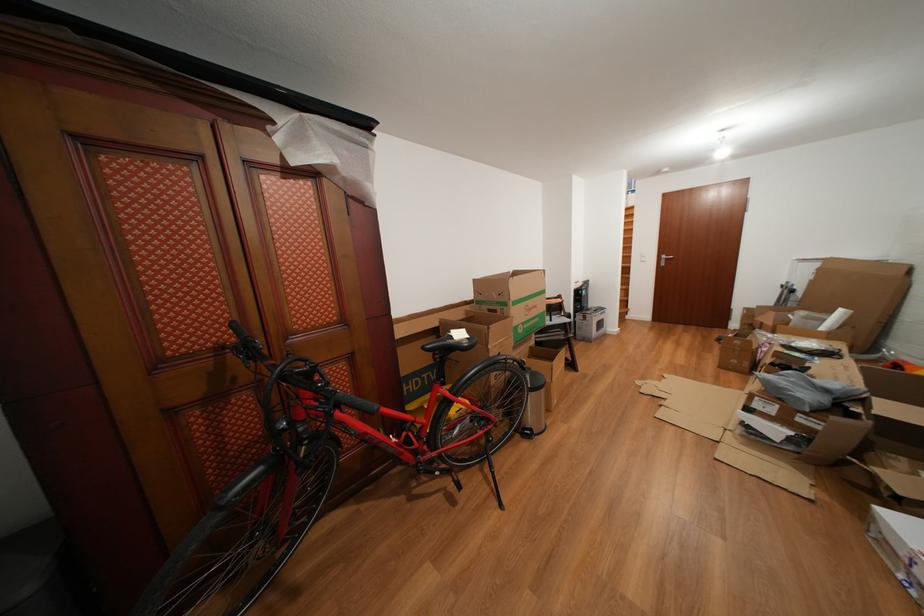
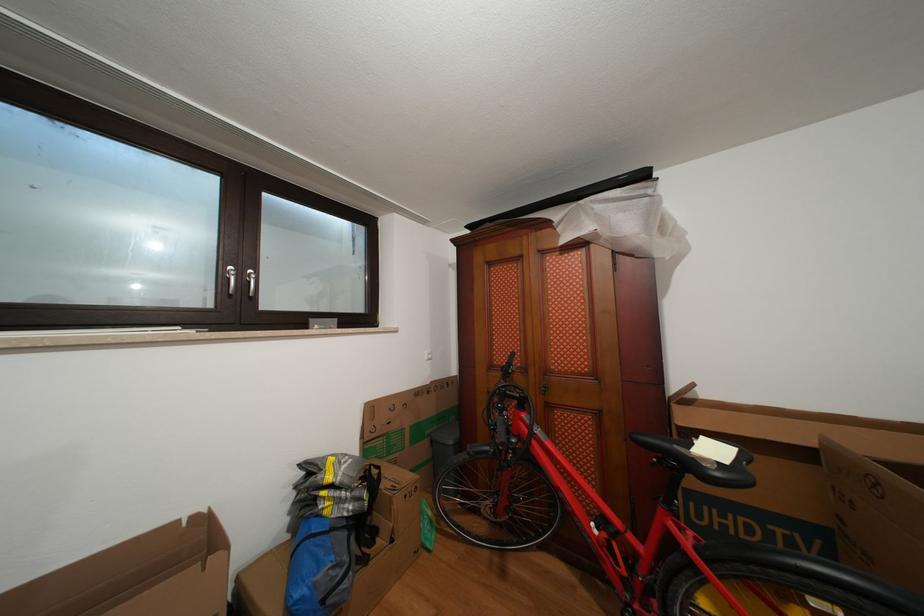
Question: Based on the continuous images, in which direction is the camera rotating? Reply with the corresponding letter.

Choices:
 (A) Left
 (B) Right
 (C) Up
 (D) Down

Answer: (A)